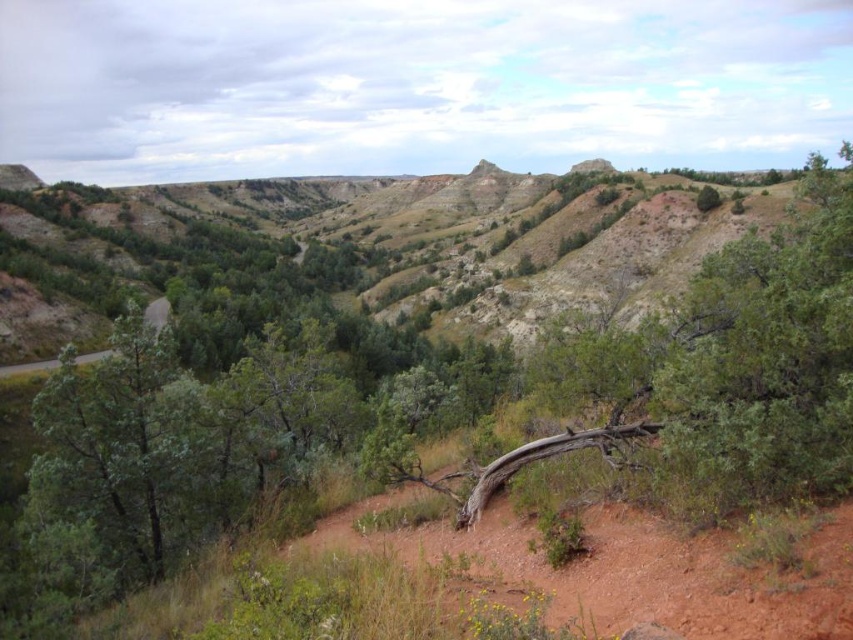
You are a hiker trying to cross the brown dirt track at center. There is a brown rough tree trunk at center blocking your path. Can you walk around it on the same level as the track?

The brown rough tree trunk at center is above the brown dirt track at center, so you can walk around it on the same level as the track since the trunk is elevated and not blocking the path horizontally.

You are a hiker trying to reach the valley on the other side of the brown rough tree trunk at center. The brown dirt track at center is your only path. Can you walk around the tree trunk to get to the track?

The brown rough tree trunk at center is closer to you than the brown dirt track at center, so you can walk around the tree trunk to access the track.

You are a hiker trying to follow the brown dirt track at center through the landscape. As you walk, you notice the brown rough tree trunk at center blocking your path. Which direction should you turn to go around it while staying on the track?

Since the brown rough tree trunk at center is to the right of the brown dirt track at center, you should turn to your left to go around it while staying on the track.